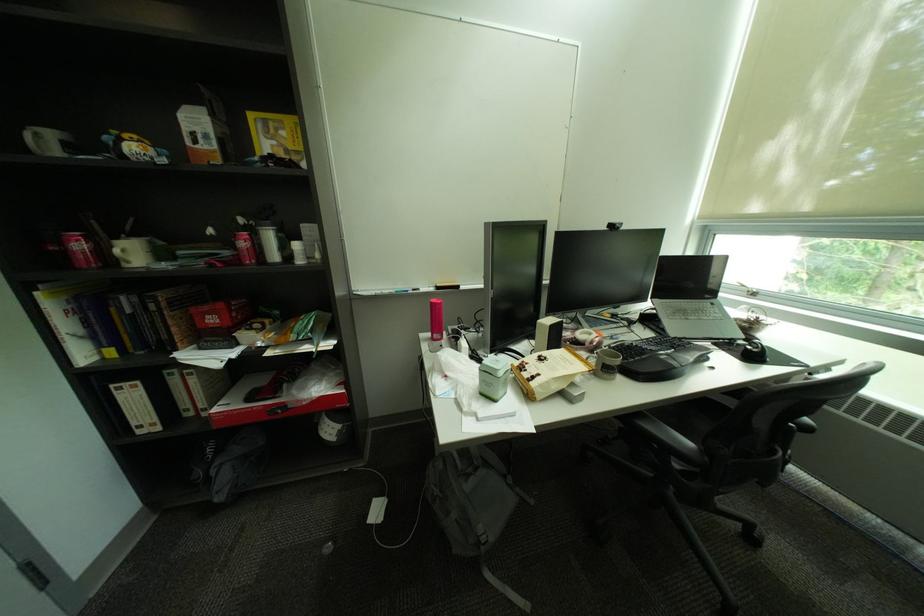
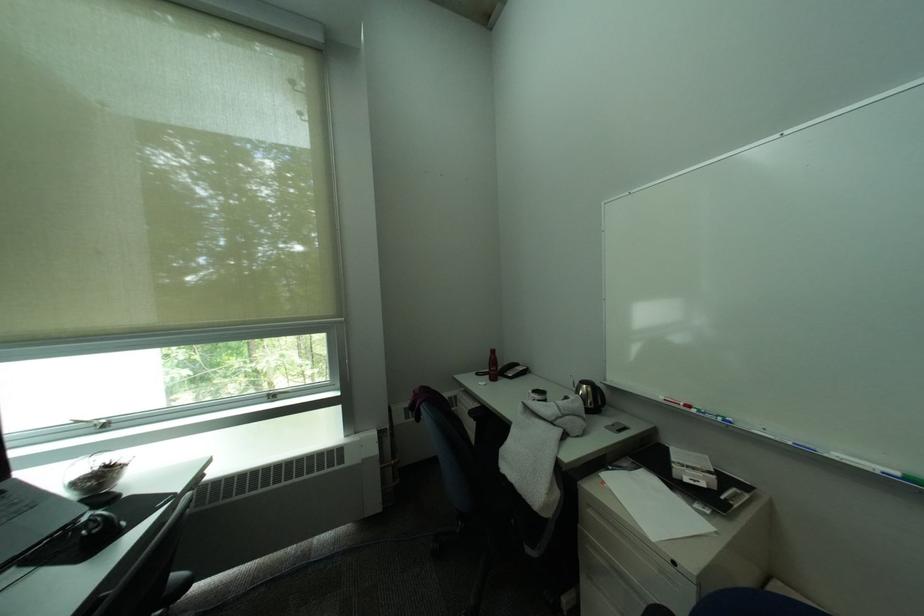
Where in the second image is the point corresponding to (x=759, y=293) from the first image?

(106, 427)